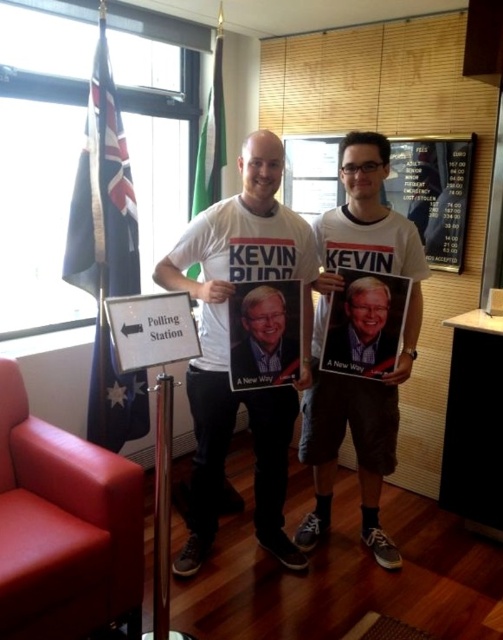
Is white t-shirt at center closer to camera compared to matte paper poster at center?

Yes, white t-shirt at center is closer to the viewer.

Describe the element at coordinates (227, 346) in the screenshot. I see `white t-shirt at center` at that location.

This screenshot has height=640, width=503. What do you see at coordinates (227, 346) in the screenshot?
I see `white t-shirt at center` at bounding box center [227, 346].

The width and height of the screenshot is (503, 640). Identify the location of white t-shirt at center. (227, 346).

Which of these two, matte paper poster at center or white plastic sign at center, stands shorter?

white plastic sign at center

Image resolution: width=503 pixels, height=640 pixels. Describe the element at coordinates (265, 333) in the screenshot. I see `matte paper poster at center` at that location.

I want to click on matte paper poster at center, so click(x=265, y=333).

How far apart are matte black poster at center and white plastic sign at center?

matte black poster at center and white plastic sign at center are 31.62 inches apart.

This screenshot has height=640, width=503. What do you see at coordinates (365, 323) in the screenshot?
I see `matte black poster at center` at bounding box center [365, 323].

Locate an element on the screen. matte black poster at center is located at coordinates (365, 323).